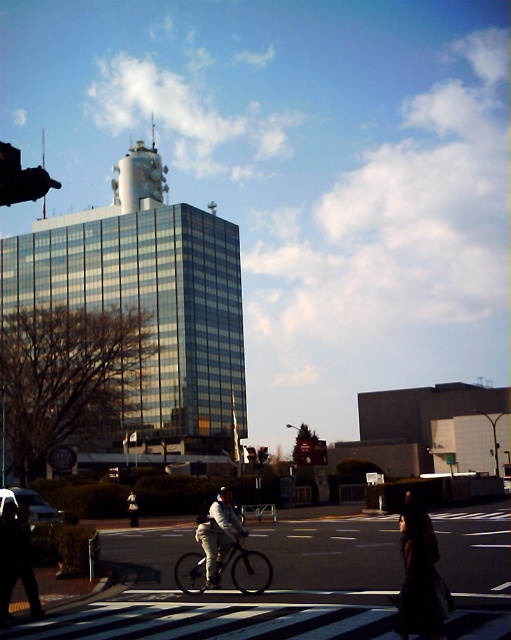
Is dark brown fabric dress at lower right smaller than metallic pole at upper center?

Indeed, dark brown fabric dress at lower right has a smaller size compared to metallic pole at upper center.

Which is below, dark brown fabric dress at lower right or metallic pole at upper center?

dark brown fabric dress at lower right is lower down.

Who is more forward, (408, 550) or (2, 188)?

Point (2, 188) is more forward.

At what (x,y) coordinates should I click in order to perform the action: click on dark brown fabric dress at lower right. Please return your answer as a coordinate pair (x, y). This screenshot has height=640, width=511. Looking at the image, I should click on (417, 580).

Is metallic pole at upper center closer to the viewer compared to dark gray fabric jacket at lower center?

Yes, it is.

Can you confirm if metallic pole at upper center is thinner than dark gray fabric jacket at lower center?

No.

In order to click on metallic pole at upper center in this screenshot , I will do `click(20, 179)`.

Is dark gray pants at lower left to the right of metallic pole at upper center from the viewer's perspective?

Yes, dark gray pants at lower left is to the right of metallic pole at upper center.

Which is behind, point (14, 577) or point (19, 196)?

Point (14, 577)

Who is more distant from viewer, [31,564] or [16,157]?

Point [31,564]

Find the location of `dark gray pants at lower left`. dark gray pants at lower left is located at coordinates (16, 561).